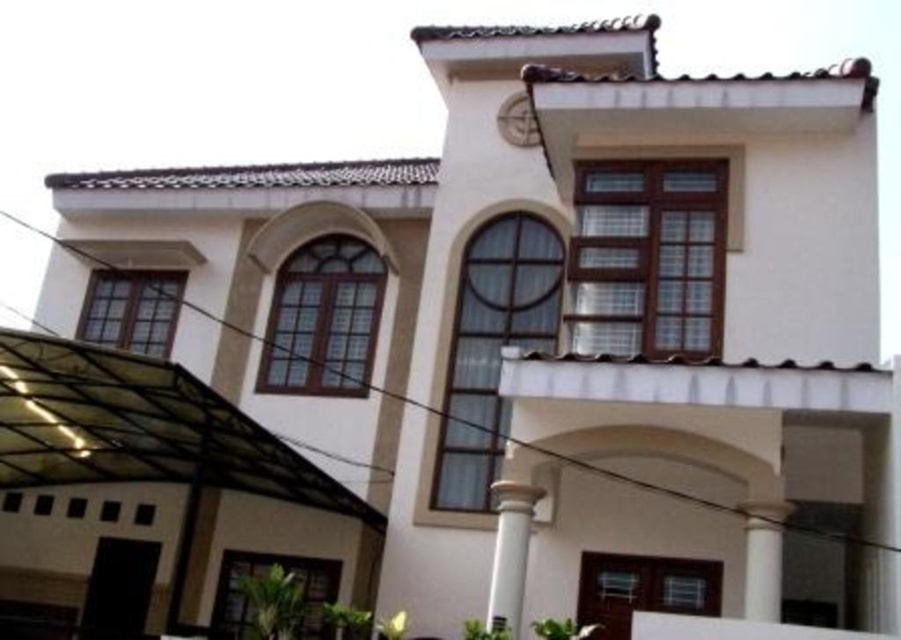
Is white glossy column at center thinner than white smooth column at center?

Incorrect, white glossy column at center's width is not less than white smooth column at center's.

Which is below, white glossy column at center or white smooth column at center?

white glossy column at center

Does point (513, 596) lie behind point (751, 515)?

Yes, point (513, 596) is farther from viewer.

The image size is (901, 640). I want to click on white glossy column at center, so click(x=510, y=552).

Can you confirm if white glossy column at center is taller than matte white clock at upper center?

Yes, white glossy column at center is taller than matte white clock at upper center.

Is white glossy column at center smaller than matte white clock at upper center?

Actually, white glossy column at center might be larger than matte white clock at upper center.

The image size is (901, 640). What are the coordinates of `white glossy column at center` in the screenshot? It's located at (510, 552).

At what (x,y) coordinates should I click in order to perform the action: click on white glossy column at center. Please return your answer as a coordinate pair (x, y). Looking at the image, I should click on (510, 552).

Does white smooth column at center appear over matte white clock at upper center?

No, white smooth column at center is not above matte white clock at upper center.

Is white smooth column at center below matte white clock at upper center?

Indeed, white smooth column at center is positioned under matte white clock at upper center.

Who is more distant from viewer, [745,506] or [539,134]?

Positioned behind is point [539,134].

What are the coordinates of `white smooth column at center` in the screenshot? It's located at (763, 557).